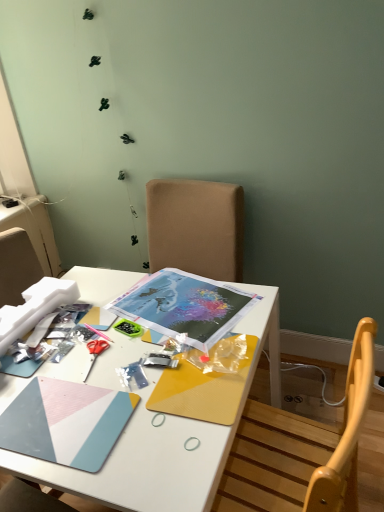
Where is `vacant area that is in front of red plastic scissors at center-left`? The width and height of the screenshot is (384, 512). vacant area that is in front of red plastic scissors at center-left is located at coordinates (81, 410).